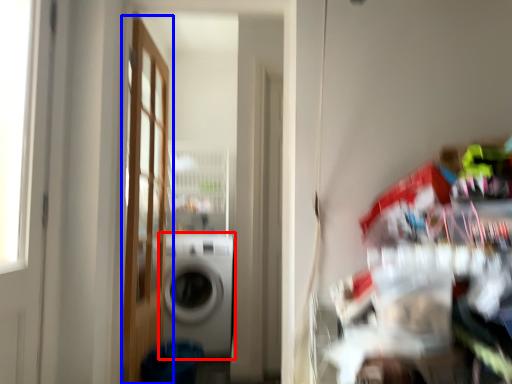
Question: Which object is further to the camera taking this photo, washing machine (highlighted by a red box) or door (highlighted by a blue box)?

Choices:
 (A) washing machine
 (B) door

Answer: (A)